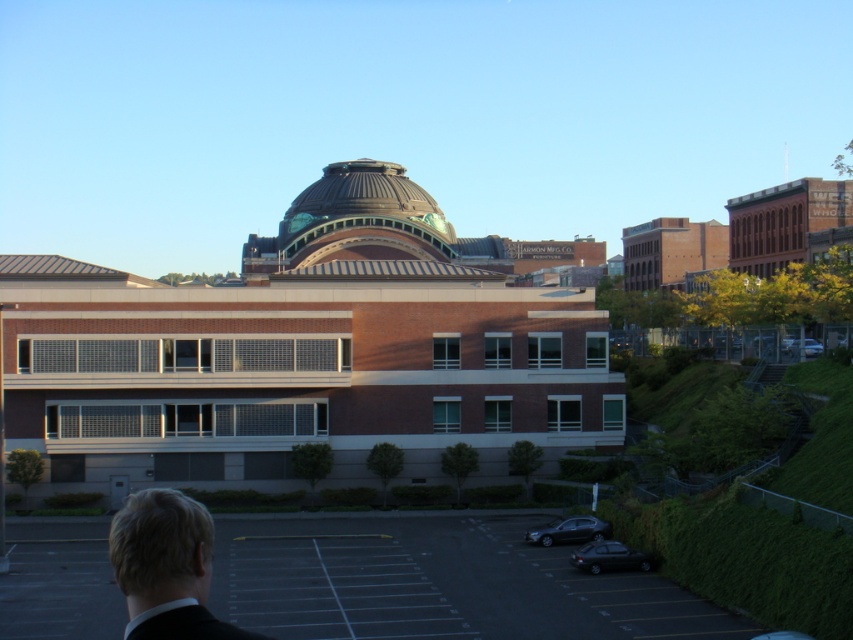
Question: Which object appears farthest from the camera in this image?

Choices:
 (A) silver metallic sedan at lower right
 (B) shiny black sedan at lower right

Answer: (A)

Question: Which of the following is the closest to the observer?

Choices:
 (A) matte black suit at lower left
 (B) black asphalt parking lot at lower center
 (C) shiny black car at lower right

Answer: (A)

Question: Which object appears farthest from the camera in this image?

Choices:
 (A) gold metallic dome at center
 (B) shiny black sedan at lower right
 (C) black asphalt parking lot at lower center
 (D) silver metallic sedan at lower right

Answer: (A)

Question: Is matte black suit at lower left behind shiny black car at lower right?

Choices:
 (A) no
 (B) yes

Answer: (A)

Question: In this image, where is dark brown suit at lower left located relative to shiny black sedan at lower right?

Choices:
 (A) left
 (B) right

Answer: (A)

Question: Does dark brown suit at lower left have a lesser width compared to silver metallic sedan at lower right?

Choices:
 (A) yes
 (B) no

Answer: (B)